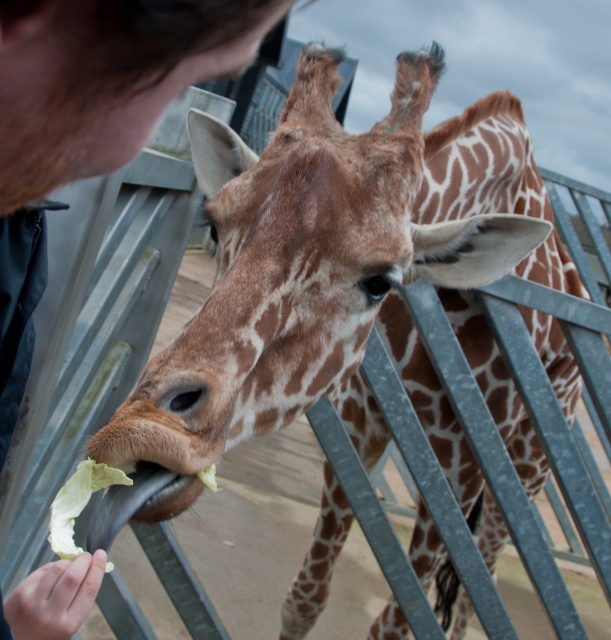
Which is below, dark brown hair at upper left or green leafy vegetable at lower left?

Positioned lower is green leafy vegetable at lower left.

Is point (43, 4) farther from camera compared to point (68, 477)?

No.

The height and width of the screenshot is (640, 611). What are the coordinates of `dark brown hair at upper left` in the screenshot? It's located at (95, 99).

Looking at this image, is skinny white hand at lower left positioned at the back of soft brown fur at center?

No, it is not.

Where is `skinny white hand at lower left`? skinny white hand at lower left is located at coordinates (54, 596).

At what (x,y) coordinates should I click in order to perform the action: click on skinny white hand at lower left. Please return your answer as a coordinate pair (x, y). Looking at the image, I should click on (54, 596).

Where is `skinny white hand at lower left`? skinny white hand at lower left is located at coordinates click(x=54, y=596).

Does soft brown fur at center have a smaller size compared to green leafy vegetable at lower left?

Actually, soft brown fur at center might be larger than green leafy vegetable at lower left.

Can you confirm if soft brown fur at center is wider than green leafy vegetable at lower left?

Correct, the width of soft brown fur at center exceeds that of green leafy vegetable at lower left.

Between point (144, 464) and point (122, 472), which one is positioned in front?

Point (122, 472) is more forward.

Image resolution: width=611 pixels, height=640 pixels. I want to click on soft brown fur at center, so click(144, 499).